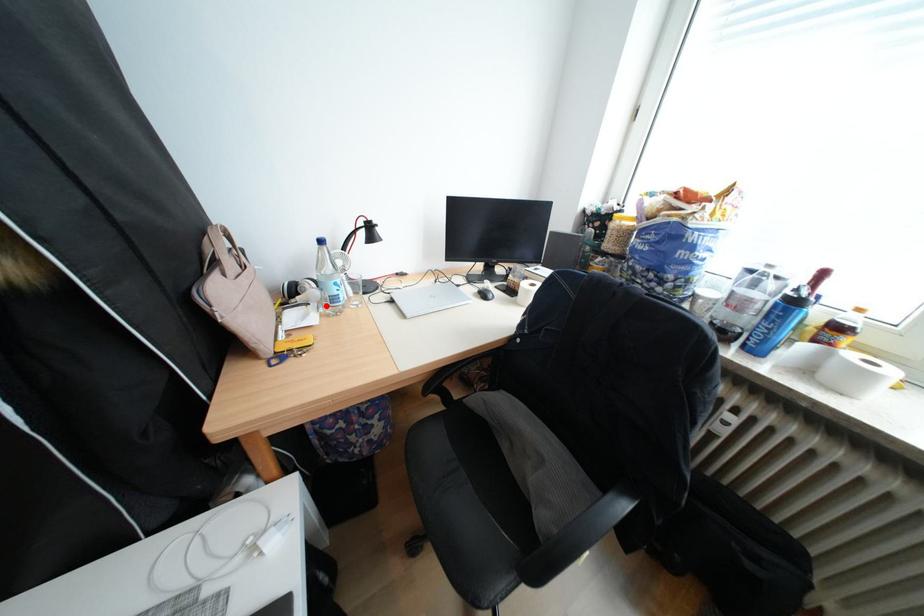
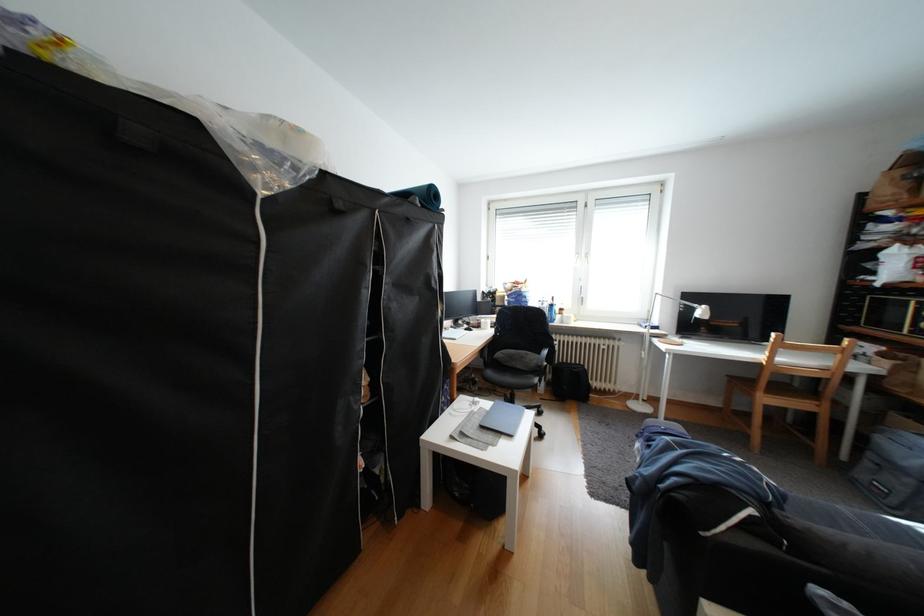
Question: I am providing you with two images of the same scene from different viewpoints. A red point is marked on the first image. At the location where the point appears in image 1, is it still visible in image 2?

Choices:
 (A) Yes
 (B) No

Answer: (B)